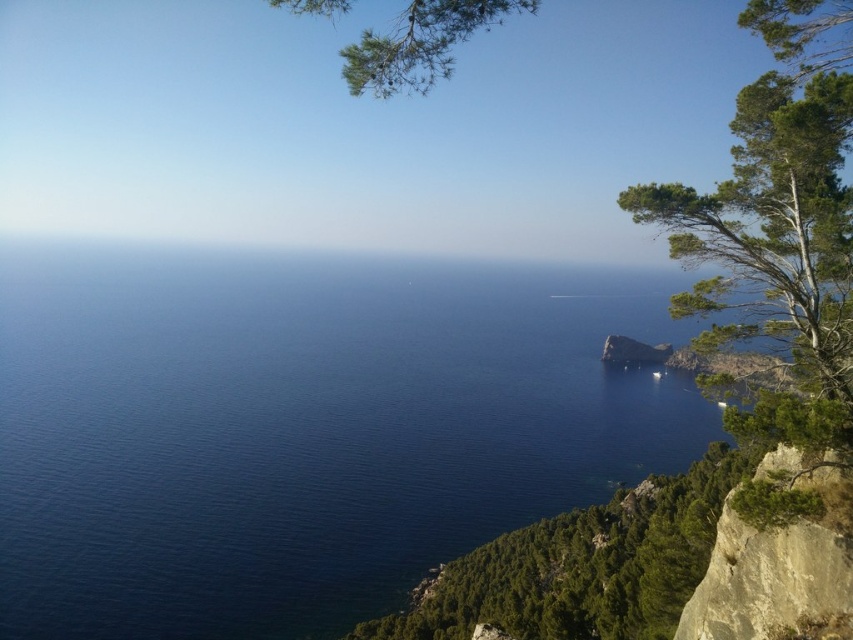
Question: Is deep blue water at center to the right of green textured tree at upper right from the viewer's perspective?

Choices:
 (A) no
 (B) yes

Answer: (B)

Question: Which object is positioned farthest from the deep blue water at center?

Choices:
 (A) green textured tree at upper right
 (B) rough textured rock at lower right
 (C) green needle-like leaves at upper center

Answer: (A)

Question: Which point is farther to the camera?

Choices:
 (A) (434, 3)
 (B) (814, 602)

Answer: (B)

Question: Does rough textured rock at lower right appear on the left side of green textured tree at upper right?

Choices:
 (A) no
 (B) yes

Answer: (B)

Question: Is deep blue water at center in front of green textured tree at upper right?

Choices:
 (A) no
 (B) yes

Answer: (A)

Question: Which object appears farthest from the camera in this image?

Choices:
 (A) green textured tree at upper right
 (B) rough textured rock at lower right

Answer: (B)